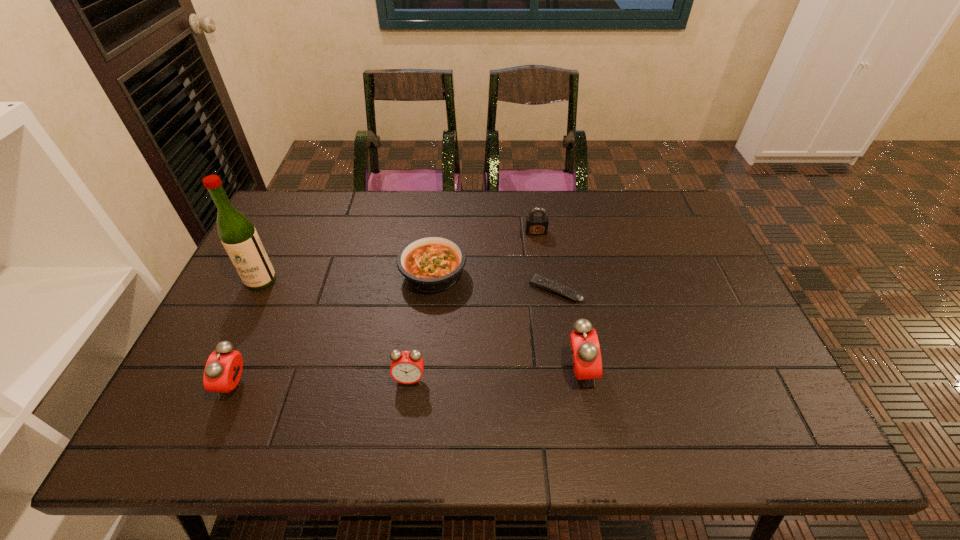
You are a GUI agent. You are given a task and a screenshot of the screen. Output one action in this format:
    pyautogui.click(x=<x>, y=<y>)
    Task: Click on the unoccupied position between the second tallest alarm clock and the second alarm clock from left to right
    The width and height of the screenshot is (960, 540).
    Given the screenshot: What is the action you would take?
    pyautogui.click(x=323, y=382)

This screenshot has height=540, width=960. Find the location of `blank region between the tallest alarm clock and the farthest object`. blank region between the tallest alarm clock and the farthest object is located at coordinates click(558, 302).

At what (x,y) coordinates should I click in order to perform the action: click on unoccupied area between the farthest object and the rightmost alarm clock. Please return your answer as a coordinate pair (x, y). This screenshot has height=540, width=960. Looking at the image, I should click on (558, 302).

Select which object is the closest to the tallest alarm clock. Please provide its 2D coordinates. Your answer should be formatted as a tuple, i.e. [(x, y)], where the tuple contains the x and y coordinates of a point satisfying the conditions above.

[(542, 282)]

Locate which object ranks second in proximity to the liquor. Please provide its 2D coordinates. Your answer should be formatted as a tuple, i.e. [(x, y)], where the tuple contains the x and y coordinates of a point satisfying the conditions above.

[(431, 263)]

In order to click on alarm clock that can be found as the closest to the liquor in this screenshot , I will do `click(223, 369)`.

Identify the location of alarm clock that is the second closest to the shortest object. (407, 367).

In order to click on vacant region that satisfies the following two spatial constraints: 1. on the label of the liquor; 2. on the right side of the shortest object in this screenshot , I will do `click(256, 290)`.